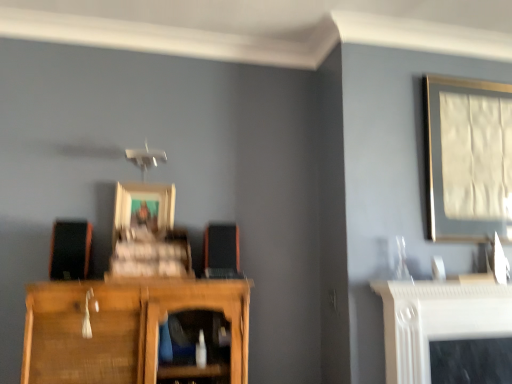
Where is `matte silver picture frame at upper right, arranged as the 1th picture frame when viewed from the right`? Image resolution: width=512 pixels, height=384 pixels. matte silver picture frame at upper right, arranged as the 1th picture frame when viewed from the right is located at coordinates (468, 159).

Identify the location of wooden picture frame at center, placed as the first picture frame when sorted from left to right. Image resolution: width=512 pixels, height=384 pixels. (143, 207).

Which point is more forward, (109, 379) or (437, 206)?

Point (109, 379)

This screenshot has width=512, height=384. What are the coordinates of `picture frame on the right of wooden cupboard at lower left` in the screenshot? It's located at (468, 159).

Between wooden cupboard at lower left and matte silver picture frame at upper right, arranged as the 1th picture frame when viewed from the right, which one has larger width?

Wider between the two is wooden cupboard at lower left.

From the picture: How different are the orientations of wooden cupboard at lower left and matte silver picture frame at upper right, the second picture frame when ordered from left to right, in degrees?

A: 2.71 degrees.

Does point (217, 263) appear closer or farther from the camera than point (233, 383)?

Clearly, point (217, 263) is more distant from the camera than point (233, 383).

From a real-world perspective, is orange matte speaker at center, which ranks as the first speaker in right-to-left order, beneath wooden cupboard at lower left?

No, from a real-world perspective, orange matte speaker at center, which ranks as the first speaker in right-to-left order, is not beneath wooden cupboard at lower left.

From the picture: Considering the positions of objects orange matte speaker at center, which ranks as the first speaker in right-to-left order, and wooden cupboard at lower left in the image provided, who is more to the right, orange matte speaker at center, which ranks as the first speaker in right-to-left order, or wooden cupboard at lower left?

Positioned to the right is orange matte speaker at center, which ranks as the first speaker in right-to-left order.

Considering the relative sizes of orange matte speaker at center, which ranks as the first speaker in right-to-left order, and wooden cupboard at lower left in the image provided, is orange matte speaker at center, which ranks as the first speaker in right-to-left order, wider than wooden cupboard at lower left?

No.

From the image's perspective, relative to matte silver picture frame at upper right, the second picture frame when ordered from left to right, is orange matte speaker at center, which ranks as the first speaker in right-to-left order, above or below?

Based on their image positions, orange matte speaker at center, which ranks as the first speaker in right-to-left order, is located beneath matte silver picture frame at upper right, the second picture frame when ordered from left to right.

Is orange matte speaker at center, the 2th speaker in the left-to-right sequence, facing away from matte silver picture frame at upper right, arranged as the 1th picture frame when viewed from the right?

That's not correct — orange matte speaker at center, the 2th speaker in the left-to-right sequence, is not looking away from matte silver picture frame at upper right, arranged as the 1th picture frame when viewed from the right.

From the picture: Is orange matte speaker at center, the 2th speaker in the left-to-right sequence, closer to the viewer compared to matte silver picture frame at upper right, arranged as the 1th picture frame when viewed from the right?

Yes, the depth of orange matte speaker at center, the 2th speaker in the left-to-right sequence, is less than that of matte silver picture frame at upper right, arranged as the 1th picture frame when viewed from the right.

Considering the points (69, 232) and (96, 295), which point is in front, point (69, 232) or point (96, 295)?

The point (96, 295) is closer to the camera.

Is matte black speaker at left, acting as the first speaker starting from the left, to the left or to the right of wooden cupboard at lower left in the image?

From the image, it's evident that matte black speaker at left, acting as the first speaker starting from the left, is to the left of wooden cupboard at lower left.

Are matte black speaker at left, acting as the first speaker starting from the left, and wooden cupboard at lower left located far from each other?

Actually, matte black speaker at left, acting as the first speaker starting from the left, and wooden cupboard at lower left are a little close together.

Which is in front, matte black speaker at left, the second speaker in the right-to-left sequence, or wooden cupboard at lower left?

Positioned in front is wooden cupboard at lower left.

In the scene shown: Can you tell me how much matte black speaker at left, the second speaker in the right-to-left sequence, and matte silver picture frame at upper right, the second picture frame when ordered from left to right, differ in facing direction?

The angle between the facing direction of matte black speaker at left, the second speaker in the right-to-left sequence, and the facing direction of matte silver picture frame at upper right, the second picture frame when ordered from left to right, is 2.7 degrees.

Do you think matte black speaker at left, acting as the first speaker starting from the left, is within matte silver picture frame at upper right, the second picture frame when ordered from left to right, or outside of it?

The correct answer is: outside.

Considering the sizes of objects matte black speaker at left, the second speaker in the right-to-left sequence, and matte silver picture frame at upper right, the second picture frame when ordered from left to right, in the image provided, who is shorter, matte black speaker at left, the second speaker in the right-to-left sequence, or matte silver picture frame at upper right, the second picture frame when ordered from left to right,?

matte black speaker at left, the second speaker in the right-to-left sequence.

In the scene shown: Can you confirm if matte black speaker at left, acting as the first speaker starting from the left, is wider than matte silver picture frame at upper right, the second picture frame when ordered from left to right?

Indeed, matte black speaker at left, acting as the first speaker starting from the left, has a greater width compared to matte silver picture frame at upper right, the second picture frame when ordered from left to right.

Considering the relative sizes of matte black speaker at left, acting as the first speaker starting from the left, and wooden picture frame at center, which ranks as the 2th picture frame in right-to-left order, in the image provided, is matte black speaker at left, acting as the first speaker starting from the left, taller than wooden picture frame at center, which ranks as the 2th picture frame in right-to-left order,?

No.

Is matte black speaker at left, acting as the first speaker starting from the left, turned away from wooden picture frame at center, which ranks as the 2th picture frame in right-to-left order?

matte black speaker at left, acting as the first speaker starting from the left, does not have its back to wooden picture frame at center, which ranks as the 2th picture frame in right-to-left order.

Which point is more forward, (79, 239) or (152, 187)?

The point (79, 239) is in front.

You are a GUI agent. You are given a task and a screenshot of the screen. Output one action in this format:
    pyautogui.click(x=<x>, y=<y>)
    Task: Click on the picture frame that is the 2nd object located behind the matte black speaker at left, the second speaker in the right-to-left sequence
    The height and width of the screenshot is (384, 512).
    Given the screenshot: What is the action you would take?
    pyautogui.click(x=143, y=207)

Which object is wider, wooden cupboard at lower left or matte black speaker at left, the second speaker in the right-to-left sequence?

Wider between the two is wooden cupboard at lower left.

From a real-world perspective, which object stands above the other?

From a 3D spatial view, matte black speaker at left, the second speaker in the right-to-left sequence, is above.

Locate an element on the screen. The height and width of the screenshot is (384, 512). cupboard to the right of matte black speaker at left, acting as the first speaker starting from the left is located at coordinates (121, 328).

This screenshot has width=512, height=384. I want to click on cupboard below the matte silver picture frame at upper right, the second picture frame when ordered from left to right (from a real-world perspective), so click(x=121, y=328).

Locate an element on the screen. The height and width of the screenshot is (384, 512). the 1st speaker above when counting from the wooden cupboard at lower left (from the image's perspective) is located at coordinates (221, 250).

From the picture: Looking at the image, which one is located further to matte silver picture frame at upper right, the second picture frame when ordered from left to right, wooden cupboard at lower left or orange matte speaker at center, the 2th speaker in the left-to-right sequence?

The object further to matte silver picture frame at upper right, the second picture frame when ordered from left to right, is wooden cupboard at lower left.

When comparing their distances from matte black speaker at left, acting as the first speaker starting from the left, does orange matte speaker at center, the 2th speaker in the left-to-right sequence, or wooden picture frame at center, which ranks as the 2th picture frame in right-to-left order, seem closer?

wooden picture frame at center, which ranks as the 2th picture frame in right-to-left order, is positioned closer to the anchor matte black speaker at left, acting as the first speaker starting from the left.

From the image, which object appears to be farther from orange matte speaker at center, which ranks as the first speaker in right-to-left order, matte black speaker at left, acting as the first speaker starting from the left, or wooden picture frame at center, placed as the first picture frame when sorted from left to right?

Among the two, matte black speaker at left, acting as the first speaker starting from the left, is located further to orange matte speaker at center, which ranks as the first speaker in right-to-left order.

Based on their spatial positions, is matte silver picture frame at upper right, the second picture frame when ordered from left to right, or wooden cupboard at lower left further from orange matte speaker at center, the 2th speaker in the left-to-right sequence?

Among the two, matte silver picture frame at upper right, the second picture frame when ordered from left to right, is located further to orange matte speaker at center, the 2th speaker in the left-to-right sequence.

Which object lies further to the anchor point wooden cupboard at lower left, orange matte speaker at center, which ranks as the first speaker in right-to-left order, or matte black speaker at left, acting as the first speaker starting from the left?

orange matte speaker at center, which ranks as the first speaker in right-to-left order, is further to wooden cupboard at lower left.

Based on their spatial positions, is orange matte speaker at center, the 2th speaker in the left-to-right sequence, or matte silver picture frame at upper right, the second picture frame when ordered from left to right, closer to wooden cupboard at lower left?

orange matte speaker at center, the 2th speaker in the left-to-right sequence, lies closer to wooden cupboard at lower left than the other object.

Estimate the real-world distances between objects in this image. Which object is further from wooden picture frame at center, which ranks as the 2th picture frame in right-to-left order, matte black speaker at left, acting as the first speaker starting from the left, or wooden cupboard at lower left?

wooden cupboard at lower left.

In the scene shown: Estimate the real-world distances between objects in this image. Which object is closer to matte black speaker at left, acting as the first speaker starting from the left, wooden cupboard at lower left or matte silver picture frame at upper right, the second picture frame when ordered from left to right?

wooden cupboard at lower left.

I want to click on speaker located between matte black speaker at left, acting as the first speaker starting from the left, and matte silver picture frame at upper right, arranged as the 1th picture frame when viewed from the right, in the left-right direction, so click(221, 250).

The image size is (512, 384). What are the coordinates of `cupboard between matte black speaker at left, the second speaker in the right-to-left sequence, and matte silver picture frame at upper right, arranged as the 1th picture frame when viewed from the right, from left to right` in the screenshot? It's located at (121, 328).

You are a GUI agent. You are given a task and a screenshot of the screen. Output one action in this format:
    pyautogui.click(x=<x>, y=<y>)
    Task: Click on the picture frame between matte black speaker at left, acting as the first speaker starting from the left, and matte silver picture frame at upper right, the second picture frame when ordered from left to right
    
    Given the screenshot: What is the action you would take?
    pyautogui.click(x=143, y=207)

Find the location of `cupboard situated between wooden picture frame at center, which ranks as the 2th picture frame in right-to-left order, and matte silver picture frame at upper right, the second picture frame when ordered from left to right, from left to right`. cupboard situated between wooden picture frame at center, which ranks as the 2th picture frame in right-to-left order, and matte silver picture frame at upper right, the second picture frame when ordered from left to right, from left to right is located at coordinates (121, 328).